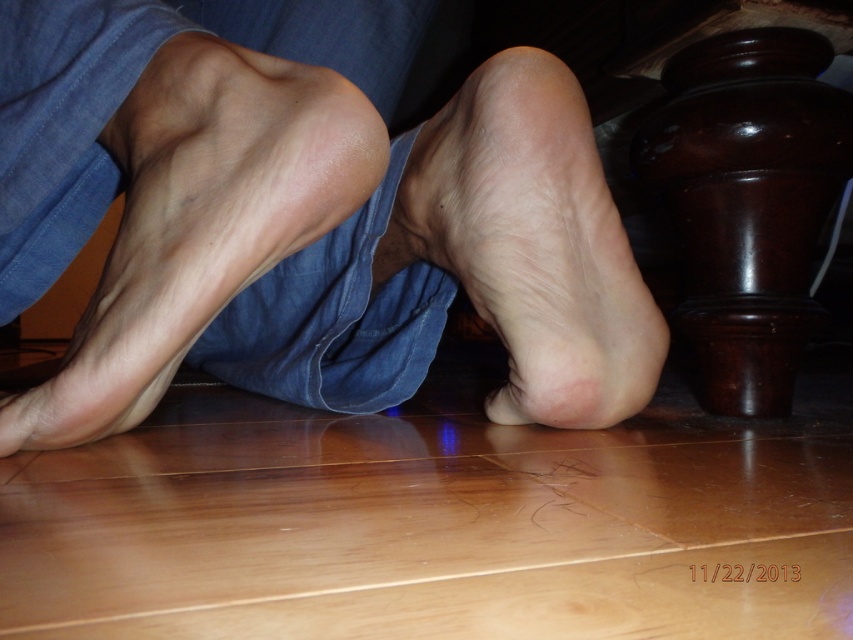
Question: Can you confirm if smooth skin feet at center is positioned above smooth skin foot at center?

Choices:
 (A) yes
 (B) no

Answer: (A)

Question: Which point appears closest to the camera in this image?

Choices:
 (A) (537, 67)
 (B) (177, 125)

Answer: (B)

Question: Does smooth skin feet at center have a smaller size compared to smooth skin foot at center?

Choices:
 (A) yes
 (B) no

Answer: (B)

Question: Among these points, which one is nearest to the camera?

Choices:
 (A) (241, 230)
 (B) (494, 115)

Answer: (A)

Question: Considering the relative positions of smooth skin feet at center and smooth skin foot at center in the image provided, where is smooth skin feet at center located with respect to smooth skin foot at center?

Choices:
 (A) left
 (B) right

Answer: (A)

Question: Which point is closer to the camera?

Choices:
 (A) smooth skin foot at center
 (B) smooth skin feet at center

Answer: (B)